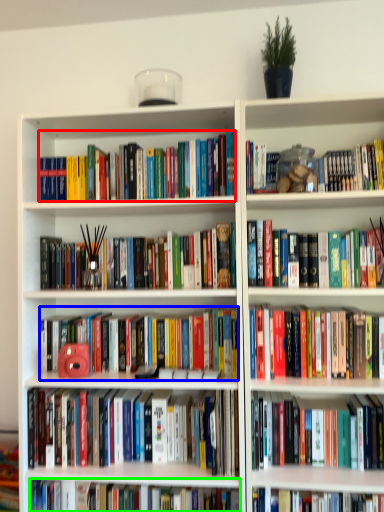
Question: Which is farther away from book (highlighted by a red box)? book (highlighted by a blue box) or book (highlighted by a green box)?

Choices:
 (A) book
 (B) book

Answer: (B)